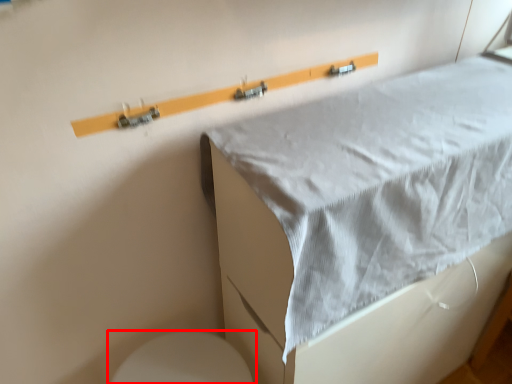
Question: Where is toilet (annotated by the red box) located in relation to furniture in the image?

Choices:
 (A) right
 (B) left

Answer: (B)